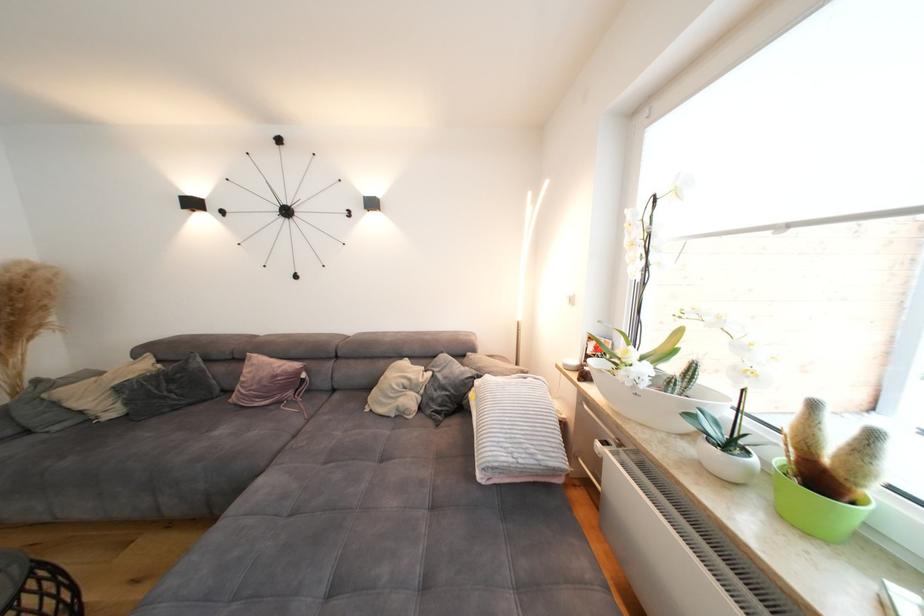
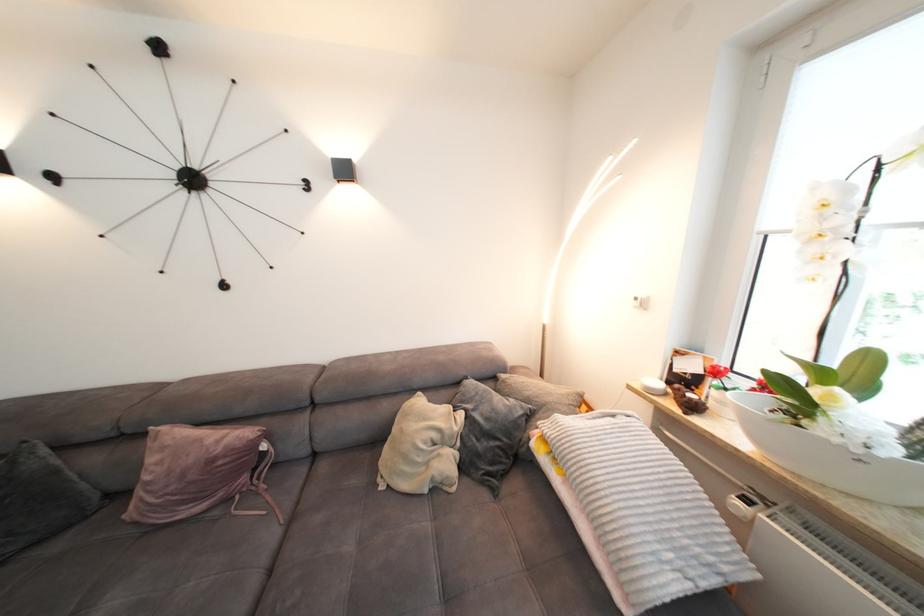
The point at (643,399) is marked in the first image. Where is the corresponding point in the second image?

(869, 467)